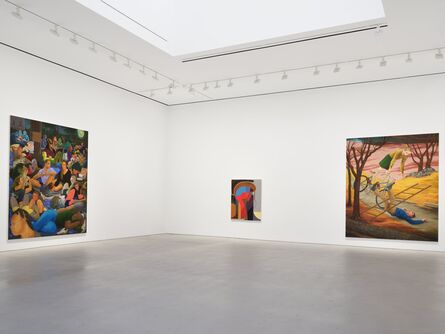
The height and width of the screenshot is (334, 445). Find the location of `floor`. floor is located at coordinates (203, 275).